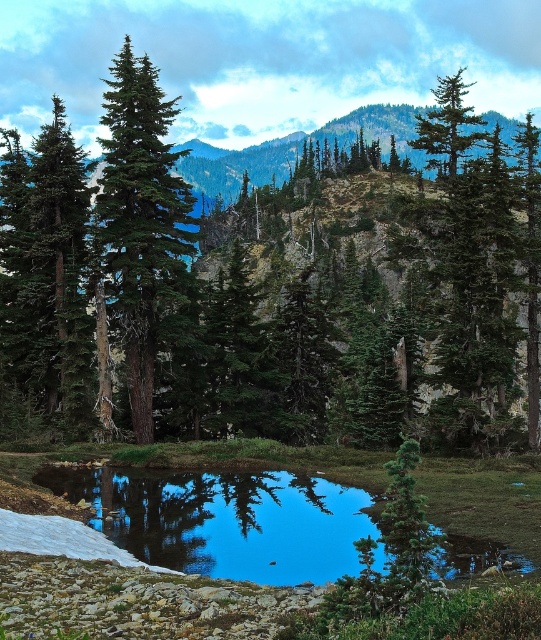
You are standing at the edge of the pond and notice the clear glass water at center and the green matte evergreen tree at upper center. Which object is positioned higher in the scene?

The green matte evergreen tree at upper center is positioned higher in the scene than the clear glass water at center.

You are standing at the edge of the pond and want to place a small statue between the clear glass water at center and the green matte evergreen tree at upper center. Based on their positions, which object should the statue be closer to?

The clear glass water at center is positioned on the left side of green matte evergreen tree at upper center, so the statue should be placed closer to the clear glass water at center since it is to the left of the tree.